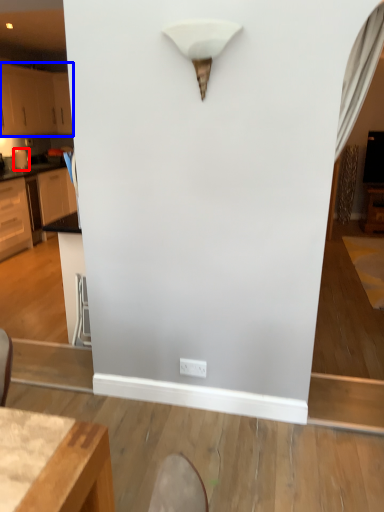
Question: Which object is further to the camera taking this photo, appliance (highlighted by a red box) or cabinetry (highlighted by a blue box)?

Choices:
 (A) appliance
 (B) cabinetry

Answer: (A)